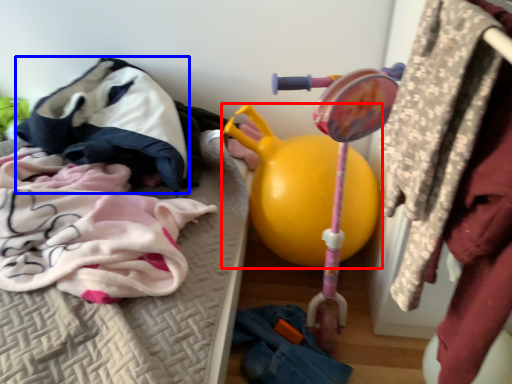
Question: Which point is further to the camera, toy (highlighted by a red box) or clothing (highlighted by a blue box)?

Choices:
 (A) toy
 (B) clothing

Answer: (B)